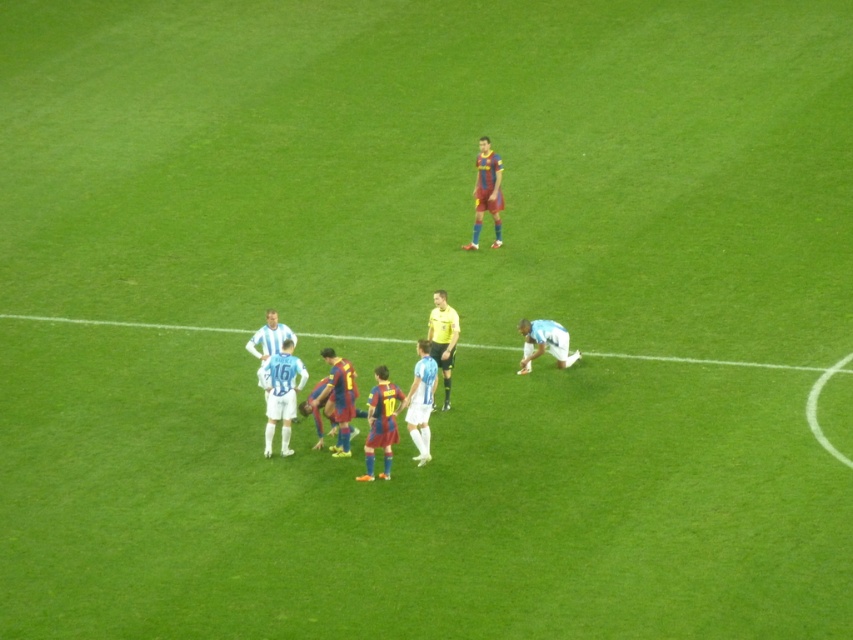
Question: Which object appears closest to the camera in this image?

Choices:
 (A) light blue jersey at center
 (B) white fabric line at lower center
 (C) white matte jersey at lower right
 (D) yellow shirt at center

Answer: (A)

Question: Can you confirm if maroon jersey at upper center is bigger than white matte jersey at lower right?

Choices:
 (A) yes
 (B) no

Answer: (A)

Question: Does white fabric line at lower center have a lesser width compared to yellow shirt at center?

Choices:
 (A) no
 (B) yes

Answer: (A)

Question: Where is maroon jersey at upper center located in relation to white matte jersey at lower right in the image?

Choices:
 (A) left
 (B) right

Answer: (A)

Question: Which object is farther from the camera taking this photo?

Choices:
 (A) light blue jersey at center
 (B) maroon jersey at upper center
 (C) white matte jersey at lower right

Answer: (B)

Question: Which object is positioned farthest from the maroon jersey at upper center?

Choices:
 (A) white fabric line at lower center
 (B) white matte jersey at lower right
 (C) light blue jersey at center
 (D) yellow shirt at center

Answer: (C)